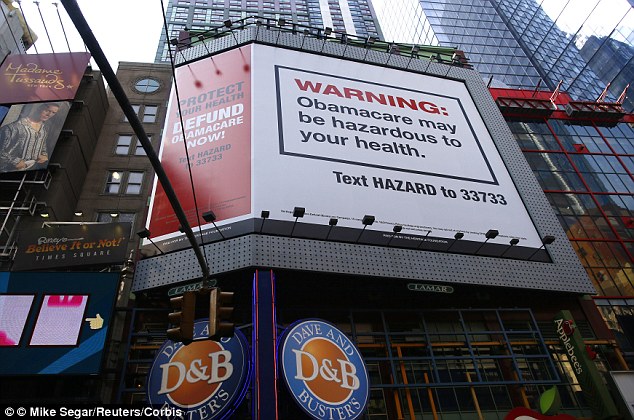
Identify the location of windows. (450, 350).